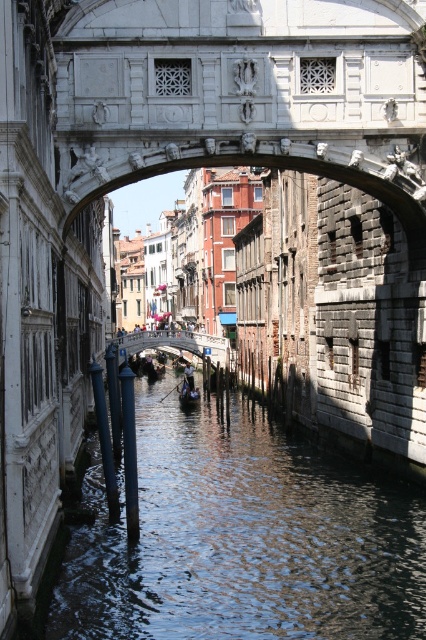
Who is more forward, (213,536) or (137,483)?

Point (137,483)

Between clear water at center and smooth white pole at center, which one is positioned lower?

Positioned lower is clear water at center.

What do you see at coordinates (241, 538) in the screenshot? The width and height of the screenshot is (426, 640). I see `clear water at center` at bounding box center [241, 538].

Identify the location of clear water at center. pos(241,538).

Does white stone bridge at center come in front of smooth gray pole at lower center?

No, white stone bridge at center is further to the viewer.

Can you confirm if white stone bridge at center is positioned above smooth gray pole at lower center?

Yes.

Who is more distant from viewer, (161,346) or (115,502)?

The point (161,346) is more distant.

Where is `white stone bridge at center`? white stone bridge at center is located at coordinates (173, 344).

Does point (121, 388) come closer to viewer compared to point (106, 426)?

Yes, point (121, 388) is in front of point (106, 426).

Can you confirm if smooth white pole at center is thinner than smooth gray pole at lower center?

No.

Describe the element at coordinates (129, 451) in the screenshot. I see `smooth white pole at center` at that location.

Image resolution: width=426 pixels, height=640 pixels. I want to click on smooth white pole at center, so click(129, 451).